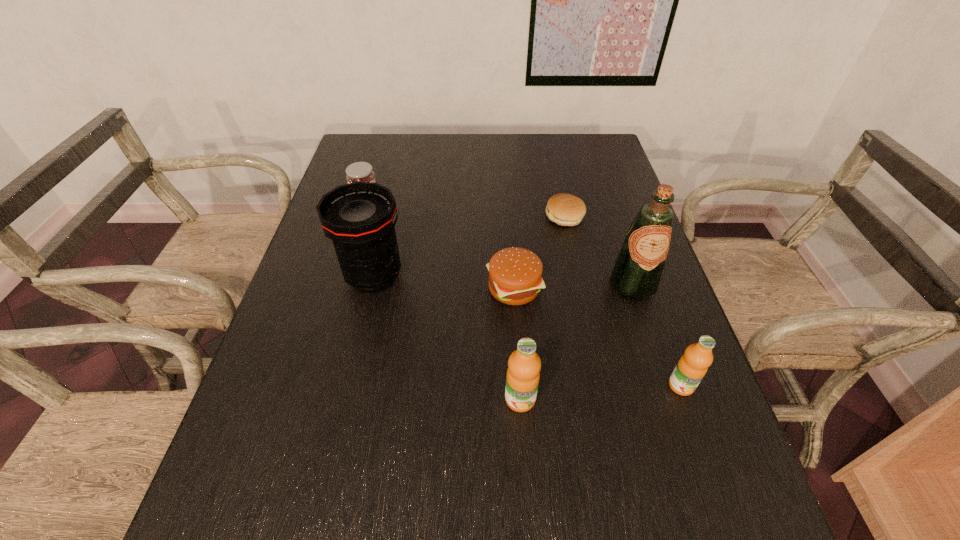
Please point a spot to add another orange juice on the left. Please provide its 2D coordinates. Your answer should be formatted as a tuple, i.e. [(x, y)], where the tuple contains the x and y coordinates of a point satisfying the conditions above.

[(351, 413)]